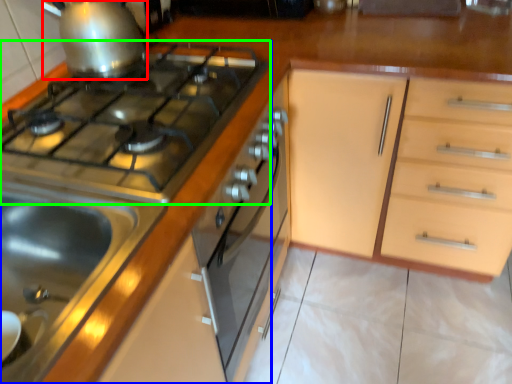
Question: Based on their relative distances, which object is nearer to kitchen appliance (highlighted by a red box)? Choose from kitchen appliance (highlighted by a blue box) and gas stove (highlighted by a green box).

Choices:
 (A) kitchen appliance
 (B) gas stove

Answer: (B)